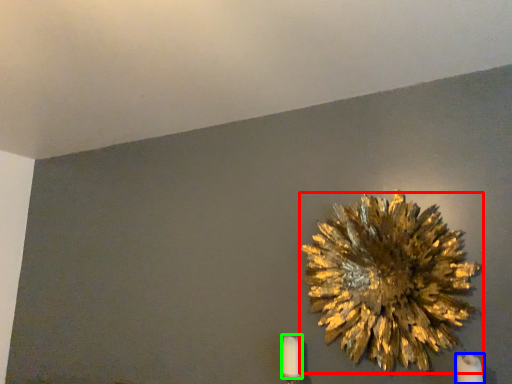
Question: Estimate the real-world distances between objects in this image. Which object is closer to flower (highlighted by a red box), candle (highlighted by a blue box) or candle (highlighted by a green box)?

Choices:
 (A) candle
 (B) candle

Answer: (A)